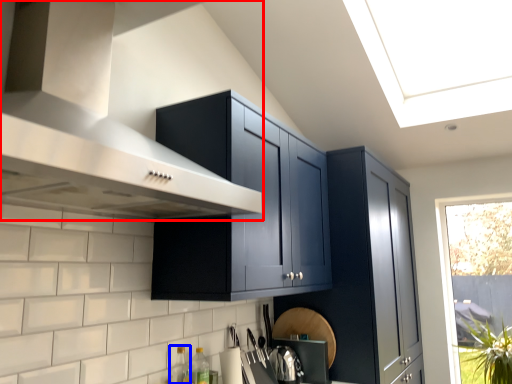
Question: Which point is further to the camera, vent (highlighted by a red box) or bottle (highlighted by a blue box)?

Choices:
 (A) vent
 (B) bottle

Answer: (B)